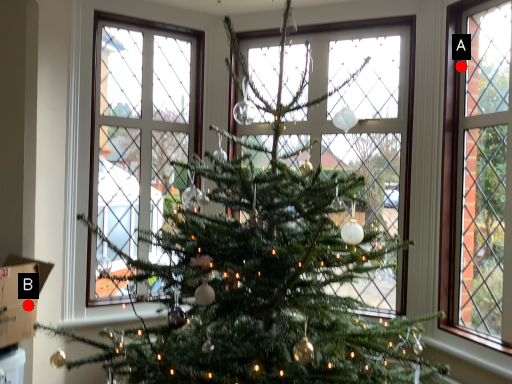
Question: Two points are circled on the image, labeled by A and B beside each circle. Which point appears farthest from the camera in this image?

Choices:
 (A) A is further
 (B) B is further

Answer: (A)